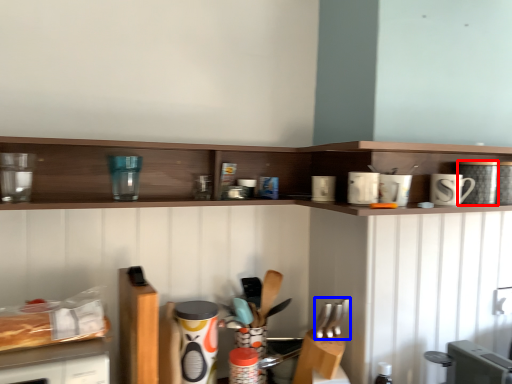
Question: Which point is closer to the camera, appliance (highlighted by a red box) or silverware (highlighted by a blue box)?

Choices:
 (A) appliance
 (B) silverware

Answer: (B)